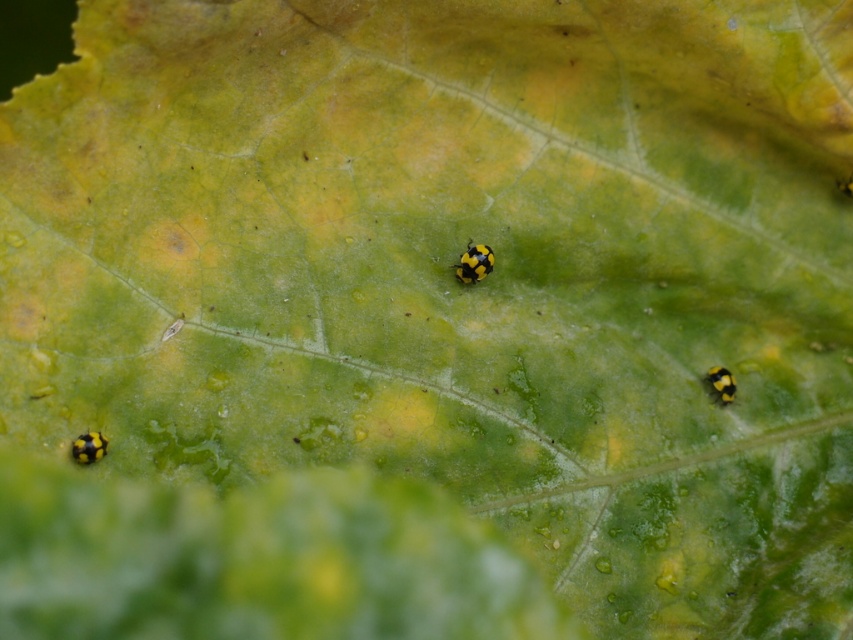
You are standing 5 feet away from the leaf. If you move closer to the leaf, will the point at point (86, 456) become larger in your view?

The distance of point (86, 456) from viewer is 4.14 feet. Since you are currently 5 feet away, moving closer to 4.14 feet would bring you to the exact distance where the point is at its standard size. Moving closer beyond that would make the point appear larger in your view.